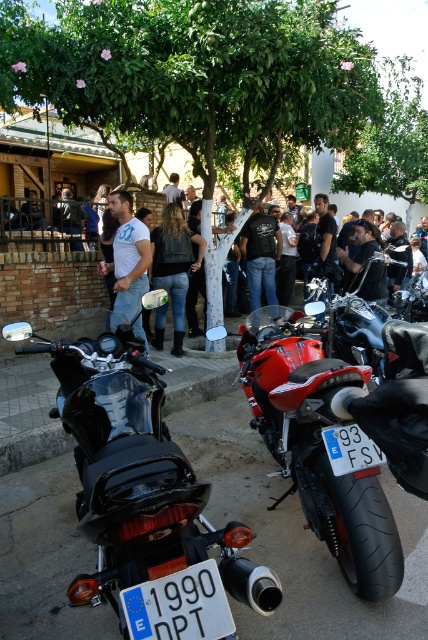
Question: Which point is farther from the camera taking this photo?

Choices:
 (A) (259, 225)
 (B) (12, 307)
 (C) (177, 228)

Answer: (A)

Question: Observing the image, what is the correct spatial positioning of black matte motorcycle at center in reference to white plastic license plate at lower center?

Choices:
 (A) left
 (B) right

Answer: (A)

Question: Which object is positioned farthest from the shiny red motorcycle at center?

Choices:
 (A) white t-shirt at center
 (B) white leather jacket at center
 (C) glossy red motorcycle at center

Answer: (B)

Question: Does shiny red motorcycle at center have a larger size compared to white t-shirt at center?

Choices:
 (A) no
 (B) yes

Answer: (B)

Question: Among these objects, which one is nearest to the camera?

Choices:
 (A) white plastic license plate at lower center
 (B) white t-shirt at center

Answer: (A)

Question: Does glossy red motorcycle at center appear under black leather jacket at center?

Choices:
 (A) no
 (B) yes

Answer: (B)